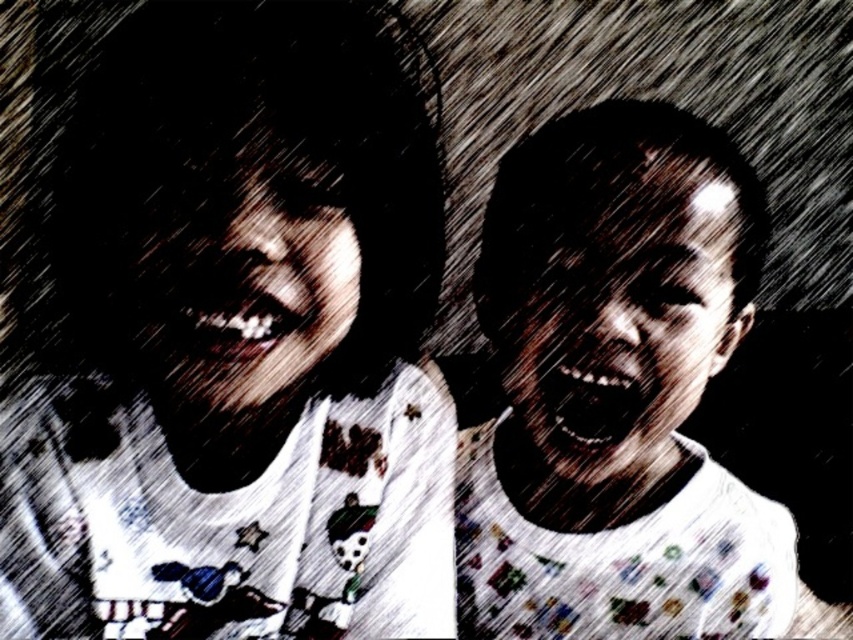
Question: Which point is farther to the camera?

Choices:
 (A) 432,260
 (B) 640,237

Answer: (B)

Question: Does white printed shirt at upper left appear under matte white shirt at right?

Choices:
 (A) yes
 (B) no

Answer: (B)

Question: Which point is farther from the camera taking this photo?

Choices:
 (A) (611, 627)
 (B) (256, 310)

Answer: (A)

Question: Does white printed shirt at upper left lie in front of matte white shirt at right?

Choices:
 (A) yes
 (B) no

Answer: (A)

Question: Which point appears closest to the camera in this image?

Choices:
 (A) (215, 490)
 (B) (535, 170)

Answer: (A)

Question: Is white printed shirt at upper left positioned at the back of matte white shirt at right?

Choices:
 (A) yes
 (B) no

Answer: (B)